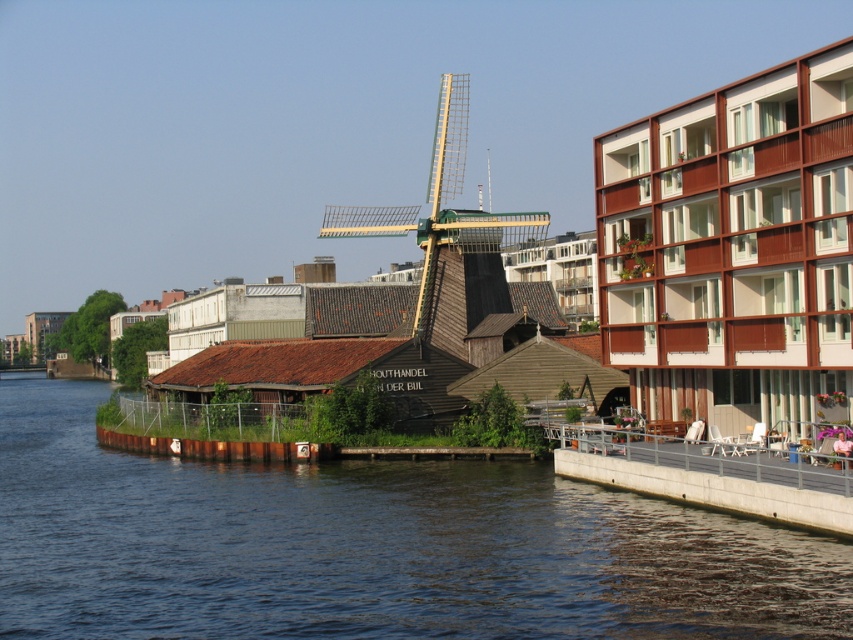
Question: Is concrete gray dock at lower right behind wooden windmill at center?

Choices:
 (A) yes
 (B) no

Answer: (B)

Question: Which point is closer to the camera taking this photo?

Choices:
 (A) (395, 216)
 (B) (817, 474)

Answer: (B)

Question: Can you confirm if dark blue water at lower left is wider than wooden windmill at center?

Choices:
 (A) yes
 (B) no

Answer: (A)

Question: Which point is farther to the camera?

Choices:
 (A) concrete gray dock at lower right
 (B) dark blue water at lower left

Answer: (A)

Question: Does concrete gray dock at lower right have a lesser width compared to wooden windmill at center?

Choices:
 (A) no
 (B) yes

Answer: (B)

Question: Estimate the real-world distances between objects in this image. Which object is closer to the wooden windmill at center?

Choices:
 (A) concrete gray dock at lower right
 (B) dark blue water at lower left

Answer: (A)